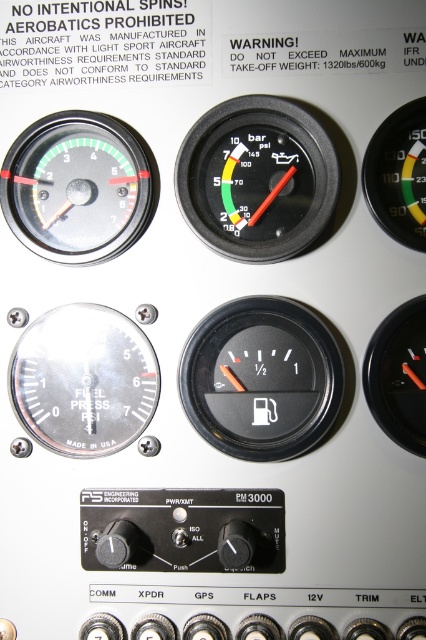
Question: Does black plastic gauge at center appear over matte black fuel pressure gauge at upper left?

Choices:
 (A) no
 (B) yes

Answer: (B)

Question: Considering the real-world distances, which object is farthest from the matte black fuel pressure gauge at center left?

Choices:
 (A) black plastic fuel gauge at center
 (B) black plastic gauge at upper right

Answer: (B)

Question: Can you confirm if black plastic gauge at center is positioned above matte black fuel pressure gauge at upper left?

Choices:
 (A) no
 (B) yes

Answer: (B)

Question: Does black plastic gauge at center have a lesser width compared to black plastic fuel gauge at center right?

Choices:
 (A) no
 (B) yes

Answer: (A)

Question: Among these objects, which one is farthest from the camera?

Choices:
 (A) matte black fuel pressure gauge at upper left
 (B) black plastic fuel gauge at center
 (C) black plastic fuel gauge at center right
 (D) black plastic gauge at upper right

Answer: (A)

Question: Based on their relative distances, which object is farther from the black plastic fuel gauge at center?

Choices:
 (A) black plastic gauge at center
 (B) matte black fuel pressure gauge at upper left
 (C) matte black fuel pressure gauge at center left

Answer: (B)